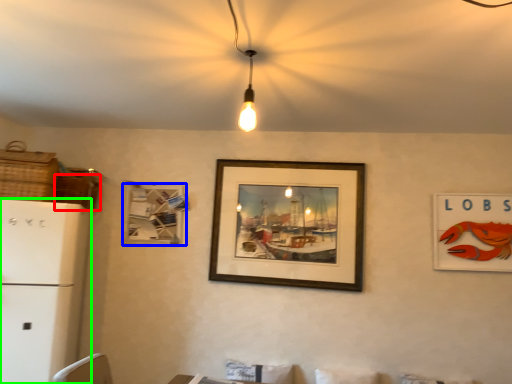
Question: Which object is the closest to the basket (highlighted by a red box)? Choose among these: picture frame (highlighted by a blue box) or fridge (highlighted by a green box).

Choices:
 (A) picture frame
 (B) fridge

Answer: (A)